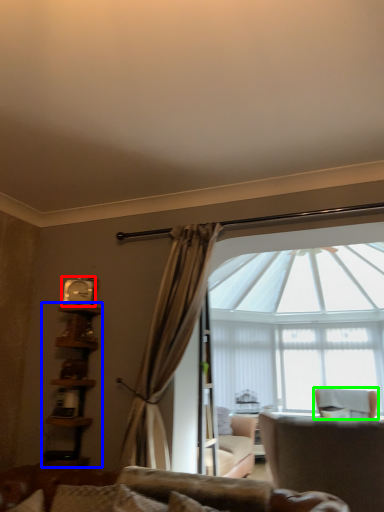
Question: Which object is positioned closest to clock (highlighted by a red box)? Select from bookshelf (highlighted by a blue box) and chair (highlighted by a green box).

Choices:
 (A) bookshelf
 (B) chair

Answer: (A)